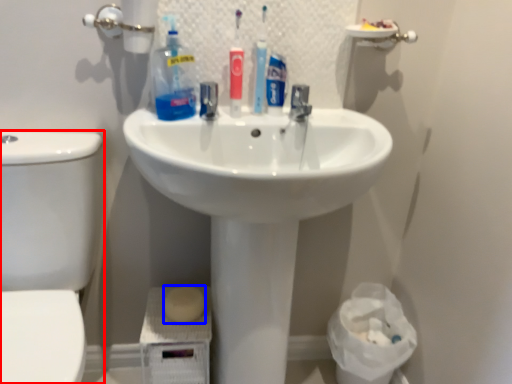
Question: Which point is closer to the camera, toilet bowl (highlighted by a red box) or soap (highlighted by a blue box)?

Choices:
 (A) toilet bowl
 (B) soap

Answer: (A)